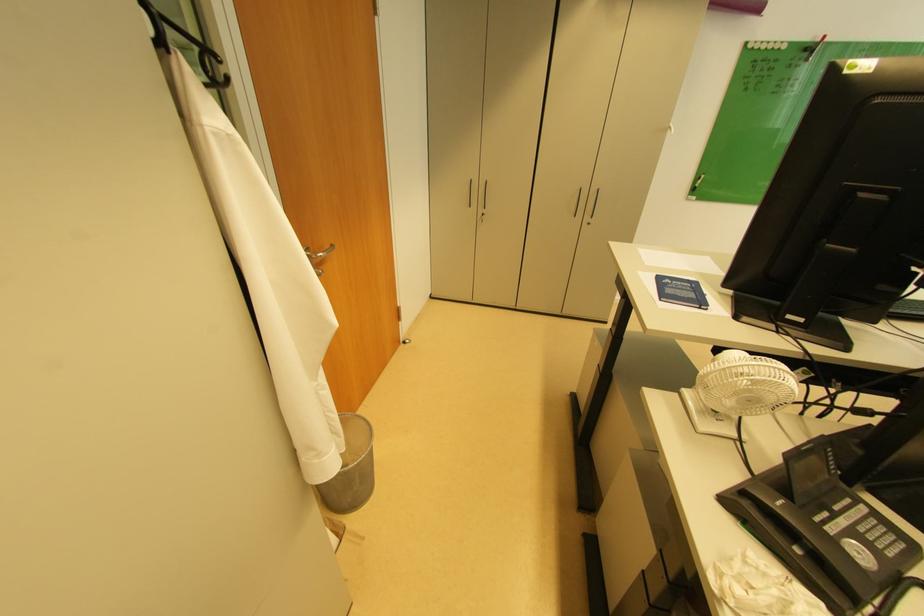
Where is `white desk fan`? white desk fan is located at coordinates (736, 391).